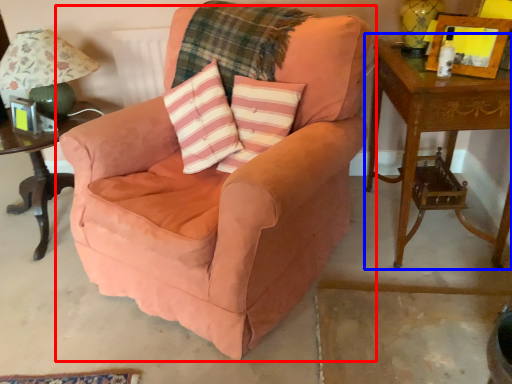
Question: Which object appears closest to the camera in this image, chair (highlighted by a red box) or table (highlighted by a blue box)?

Choices:
 (A) chair
 (B) table

Answer: (A)